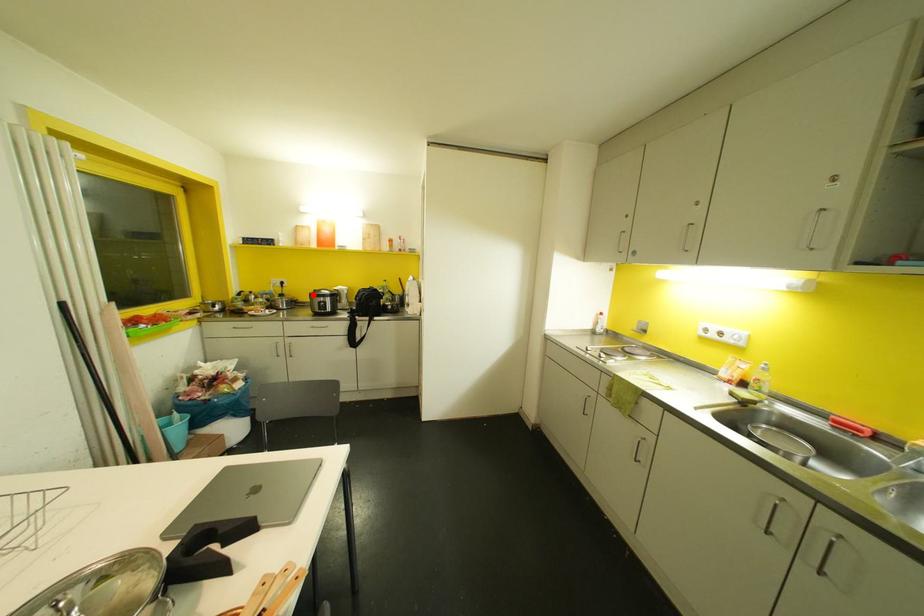
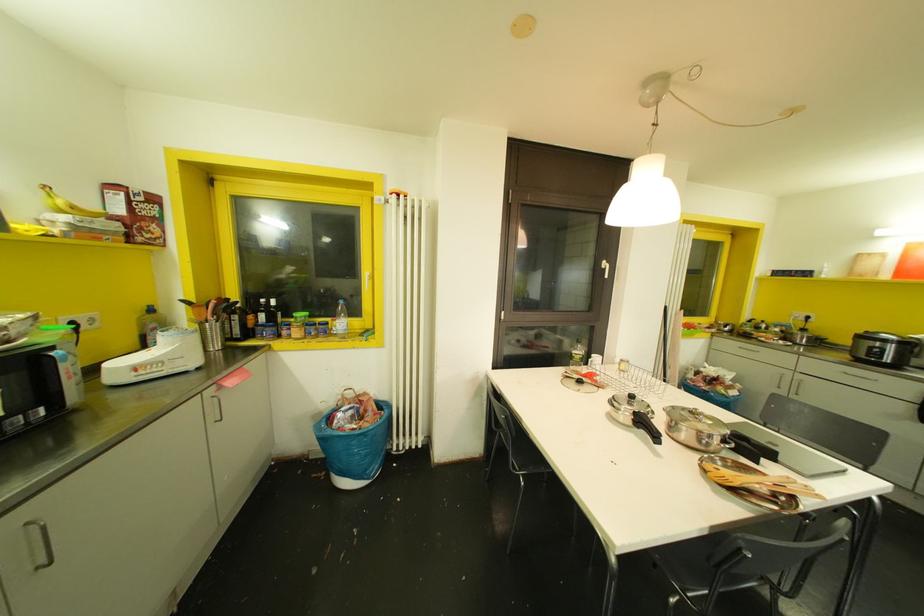
The point at the highlighted location is marked in the first image. Where is the corresponding point in the second image?

(861, 336)